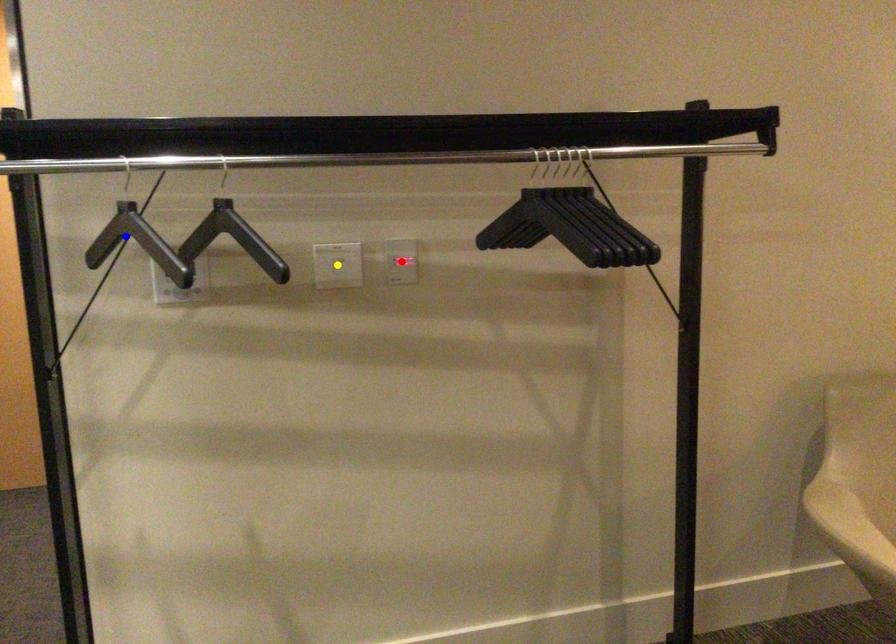
Order these from nearest to farthest:
1. red point
2. yellow point
3. blue point

1. blue point
2. yellow point
3. red point